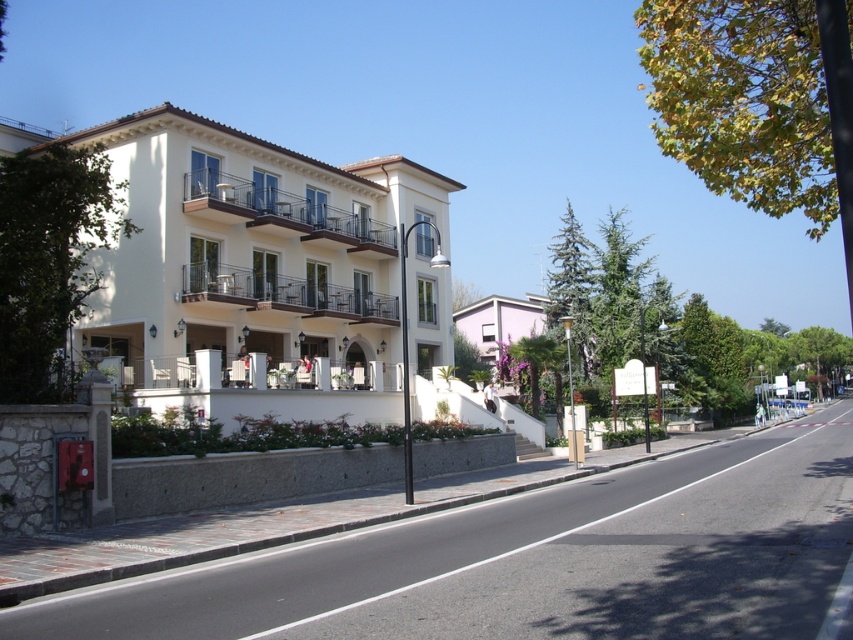
Question: Which object is farther from the camera taking this photo?

Choices:
 (A) purple matte building at center
 (B) white smooth building at center

Answer: (A)

Question: Based on their relative distances, which object is farther from the green leafy tree at upper right?

Choices:
 (A) white smooth building at center
 (B) green leafy tree at upper center

Answer: (B)

Question: Which object is positioned farthest from the green leafy tree at upper center?

Choices:
 (A) white smooth building at center
 (B) green leafy tree at upper right
 (C) purple matte building at center
 (D) green leafy tree at left

Answer: (D)

Question: Can you confirm if green leafy tree at left is positioned above purple matte building at center?

Choices:
 (A) no
 (B) yes

Answer: (B)

Question: Does purple matte building at center have a larger size compared to green leafy tree at upper center?

Choices:
 (A) no
 (B) yes

Answer: (A)

Question: Does white smooth building at center appear on the right side of green leafy tree at upper right?

Choices:
 (A) no
 (B) yes

Answer: (A)